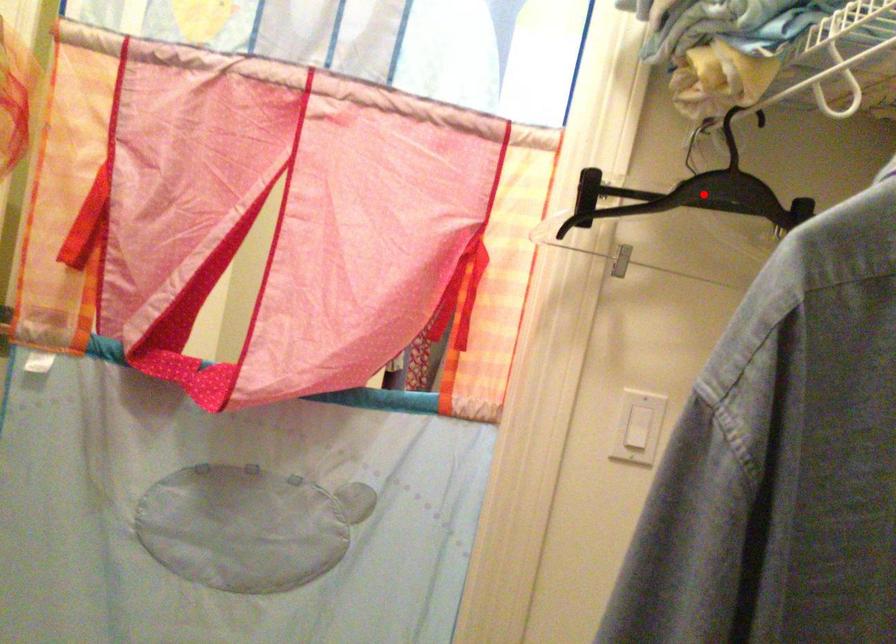
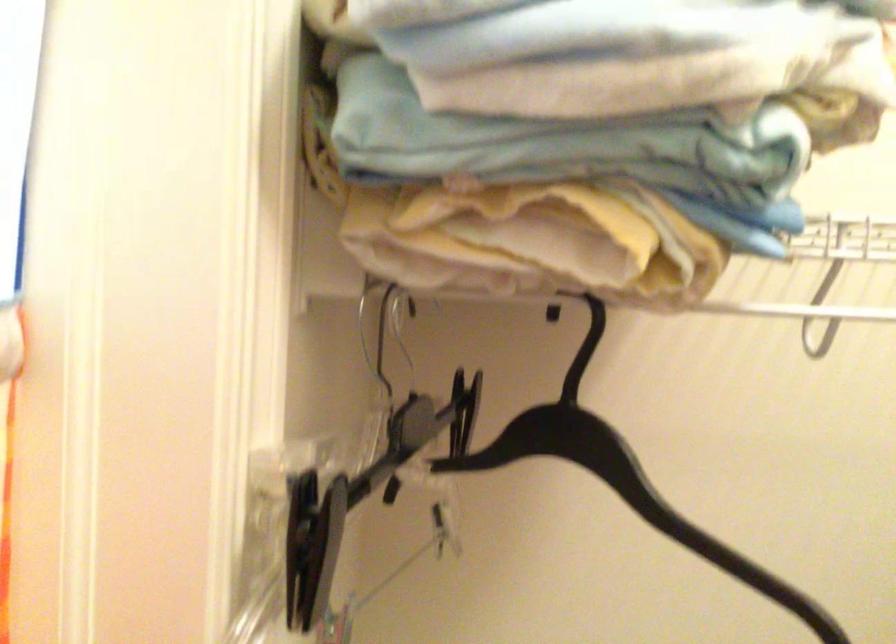
The point at the highlighted location is marked in the first image. Where is the corresponding point in the second image?

(624, 478)